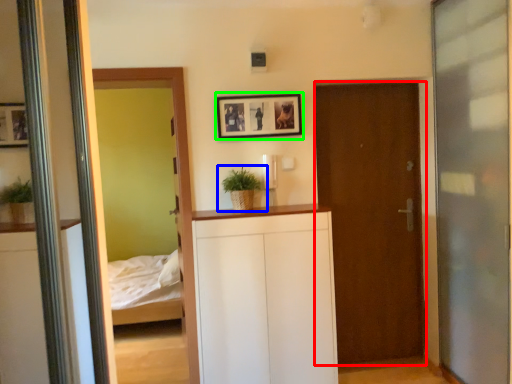
Question: Which object is the farthest from door (highlighted by a red box)? Choose among these: houseplant (highlighted by a blue box) or picture frame (highlighted by a green box).

Choices:
 (A) houseplant
 (B) picture frame

Answer: (A)